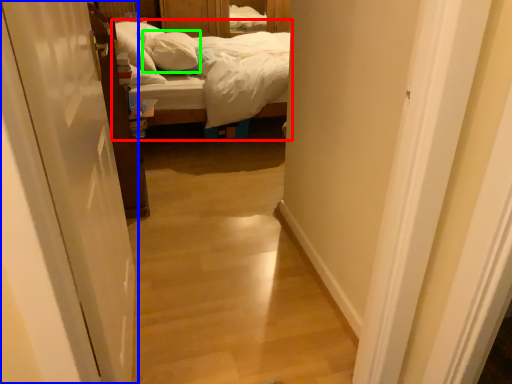
Question: Which object is positioned closest to bed (highlighted by a red box)? Select from door (highlighted by a blue box) and pillow (highlighted by a green box).

Choices:
 (A) door
 (B) pillow

Answer: (B)